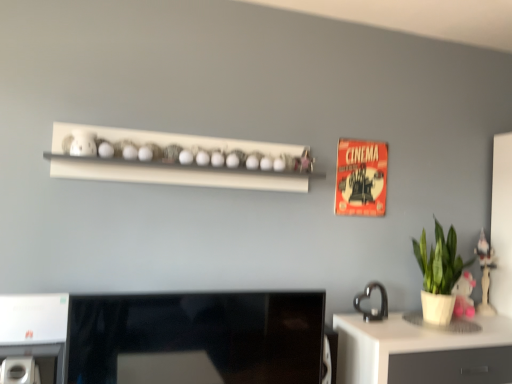
In order to face wooden figurine at right, should I rotate leftwards or rightwards?

You should rotate right by 28.336 degrees.

Describe the element at coordinates (421, 352) in the screenshot. The height and width of the screenshot is (384, 512). I see `white glossy desk at lower right` at that location.

Image resolution: width=512 pixels, height=384 pixels. I want to click on green matte plant at right, so click(x=439, y=274).

Based on the photo, what is the approximate width of white glossy shelf at upper center?

The width of white glossy shelf at upper center is 9.35 inches.

What do you see at coordinates (33, 338) in the screenshot?
I see `white plastic air conditioner at lower left, the 1th appliance positioned from the left` at bounding box center [33, 338].

The image size is (512, 384). Describe the element at coordinates (368, 297) in the screenshot. I see `black glossy heart at right, marked as the 1th appliance in a back-to-front arrangement` at that location.

The image size is (512, 384). Find the location of `wooden figurine at right`. wooden figurine at right is located at coordinates (485, 273).

Considering the points (365, 321) and (156, 165), which point is behind, point (365, 321) or point (156, 165)?

The point (365, 321) is behind.

In the scene shown: Is black glossy heart at right, positioned as the 2th appliance in front-to-back order, turned away from white glossy shelf at upper center?

No, white glossy shelf at upper center is not at the back of black glossy heart at right, positioned as the 2th appliance in front-to-back order.

From a real-world perspective, which is physically below, black glossy heart at right, which is the first appliance from right to left, or white glossy shelf at upper center?

From a 3D spatial view, black glossy heart at right, which is the first appliance from right to left, is below.

Could you measure the distance between wooden figurine at right and white plastic air conditioner at lower left, the 1th appliance positioned from the left?

wooden figurine at right and white plastic air conditioner at lower left, the 1th appliance positioned from the left, are 2.22 meters apart.

Is point (490, 311) closer to viewer compared to point (16, 380)?

That is False.

Based on their sizes in the image, would you say wooden figurine at right is bigger or smaller than white plastic air conditioner at lower left, which is the 2th appliance from back to front?

Clearly, wooden figurine at right is larger in size than white plastic air conditioner at lower left, which is the 2th appliance from back to front.

Considering the positions of point (373, 316) and point (164, 319), is point (373, 316) closer or farther from the camera than point (164, 319)?

Point (373, 316) is farther from the camera than point (164, 319).

Considering the sizes of black glossy heart at right, positioned as the 2th appliance in left-to-right order, and black glossy desktop at center in the image, is black glossy heart at right, positioned as the 2th appliance in left-to-right order, taller or shorter than black glossy desktop at center?

Considering their sizes, black glossy heart at right, positioned as the 2th appliance in left-to-right order, has less height than black glossy desktop at center.

Is black glossy heart at right, positioned as the 2th appliance in left-to-right order, facing away from black glossy desktop at center?

black glossy heart at right, positioned as the 2th appliance in left-to-right order, is not turned away from black glossy desktop at center.

Between black glossy heart at right, which is the first appliance from right to left, and black glossy desktop at center, which one has larger size?

With larger size is black glossy desktop at center.

Is black glossy heart at right, marked as the 1th appliance in a back-to-front arrangement, positioned in front of wooden figurine at right?

Yes.

Does point (380, 314) appear closer or farther from the camera than point (481, 250)?

Point (380, 314) appears to be closer to the viewer than point (481, 250).

Does black glossy heart at right, positioned as the 2th appliance in front-to-back order, turn towards wooden figurine at right?

No, black glossy heart at right, positioned as the 2th appliance in front-to-back order, does not turn towards wooden figurine at right.

The image size is (512, 384). I want to click on appliance that is the 1st one when counting downward from the wooden figurine at right (from the image's perspective), so click(368, 297).

From the image's perspective, is white glossy desk at lower right above white plastic air conditioner at lower left, which is the 2th appliance from back to front?

No.

Can you tell me how much white glossy desk at lower right and white plastic air conditioner at lower left, marked as the 2th appliance in a right-to-left arrangement, differ in facing direction?

They differ by 0.107 degrees in their facing directions.

Considering the relative sizes of white glossy desk at lower right and white plastic air conditioner at lower left, which is the 2th appliance from back to front, in the image provided, is white glossy desk at lower right shorter than white plastic air conditioner at lower left, which is the 2th appliance from back to front,?

No.

Are white glossy desk at lower right and white plastic air conditioner at lower left, which is the 1th appliance from front to back, located far from each other?

Yes, white glossy desk at lower right and white plastic air conditioner at lower left, which is the 1th appliance from front to back, are located far from each other.

Locate an element on the screen. Image resolution: width=512 pixels, height=384 pixels. shelf located on the right of white plastic air conditioner at lower left, which is the 2th appliance from back to front is located at coordinates (177, 159).

Does white plastic air conditioner at lower left, which is the 2th appliance from back to front, turn towards white glossy shelf at upper center?

No, white plastic air conditioner at lower left, which is the 2th appliance from back to front, is not turned towards white glossy shelf at upper center.

Which object is further away from the camera taking this photo, white plastic air conditioner at lower left, marked as the 2th appliance in a right-to-left arrangement, or white glossy shelf at upper center?

white glossy shelf at upper center.

In the scene shown: From the image's perspective, would you say black glossy desktop at center is positioned over white plastic air conditioner at lower left, the 1th appliance positioned from the left?

Yes.

Considering the sizes of black glossy desktop at center and white plastic air conditioner at lower left, marked as the 2th appliance in a right-to-left arrangement, in the image, is black glossy desktop at center wider or thinner than white plastic air conditioner at lower left, marked as the 2th appliance in a right-to-left arrangement,?

In the image, black glossy desktop at center appears to be more narrow than white plastic air conditioner at lower left, marked as the 2th appliance in a right-to-left arrangement.

Based on the photo, considering the relative sizes of black glossy desktop at center and white plastic air conditioner at lower left, marked as the 2th appliance in a right-to-left arrangement, in the image provided, is black glossy desktop at center smaller than white plastic air conditioner at lower left, marked as the 2th appliance in a right-to-left arrangement,?

Actually, black glossy desktop at center might be larger than white plastic air conditioner at lower left, marked as the 2th appliance in a right-to-left arrangement.

In the image, there is a white plastic air conditioner at lower left, the 1th appliance positioned from the left. Where is `desktop above it (from the image's perspective)`? desktop above it (from the image's perspective) is located at coordinates pos(163,338).

Where is `appliance that is the 1st object directly below the white glossy shelf at upper center (from a real-world perspective)`? appliance that is the 1st object directly below the white glossy shelf at upper center (from a real-world perspective) is located at coordinates (368, 297).

Which appliance is the 2nd one when counting from the front of the wooden figurine at right? Please provide its 2D coordinates.

[(33, 338)]

Which object lies nearer to the anchor point white glossy desk at lower right, white glossy shelf at upper center or black glossy desktop at center?

black glossy desktop at center lies closer to white glossy desk at lower right than the other object.

Which object lies further to the anchor point wooden figurine at right, white glossy shelf at upper center or white glossy desk at lower right?

The object further to wooden figurine at right is white glossy shelf at upper center.

Which object lies further to the anchor point white glossy desk at lower right, wooden figurine at right or white glossy shelf at upper center?

Among the two, white glossy shelf at upper center is located further to white glossy desk at lower right.

Estimate the real-world distances between objects in this image. Which object is further from black glossy heart at right, which is the first appliance from right to left, white plastic air conditioner at lower left, which is the 1th appliance from front to back, or wooden figurine at right?

white plastic air conditioner at lower left, which is the 1th appliance from front to back.

When comparing their distances from wooden figurine at right, does green matte plant at right or white glossy shelf at upper center seem further?

white glossy shelf at upper center.

Based on their spatial positions, is black glossy heart at right, positioned as the 2th appliance in left-to-right order, or wooden figurine at right closer to black glossy desktop at center?

Based on the image, black glossy heart at right, positioned as the 2th appliance in left-to-right order, appears to be nearer to black glossy desktop at center.

Considering their positions, is black glossy desktop at center positioned further to white glossy desk at lower right than white plastic air conditioner at lower left, marked as the 2th appliance in a right-to-left arrangement?

white plastic air conditioner at lower left, marked as the 2th appliance in a right-to-left arrangement.

From the image, which object appears to be nearer to wooden figurine at right, white plastic air conditioner at lower left, which is the 1th appliance from front to back, or white glossy shelf at upper center?

Based on the image, white glossy shelf at upper center appears to be nearer to wooden figurine at right.

Identify the location of appliance between white plastic air conditioner at lower left, the 1th appliance positioned from the left, and wooden figurine at right, in the horizontal direction. Image resolution: width=512 pixels, height=384 pixels. (368, 297).

Find the location of a particular element. The width and height of the screenshot is (512, 384). shelf between white plastic air conditioner at lower left, marked as the 2th appliance in a right-to-left arrangement, and black glossy heart at right, positioned as the 2th appliance in front-to-back order, in the horizontal direction is located at coordinates (177, 159).

Locate an element on the screen. appliance situated between white plastic air conditioner at lower left, the 1th appliance positioned from the left, and green matte plant at right from left to right is located at coordinates (368, 297).

You are a GUI agent. You are given a task and a screenshot of the screen. Output one action in this format:
    pyautogui.click(x=<x>, y=<y>)
    Task: Click on the shelf situated between white plastic air conditioner at lower left, which is the 1th appliance from front to back, and white glossy desk at lower right from left to right
    
    Given the screenshot: What is the action you would take?
    pyautogui.click(x=177, y=159)